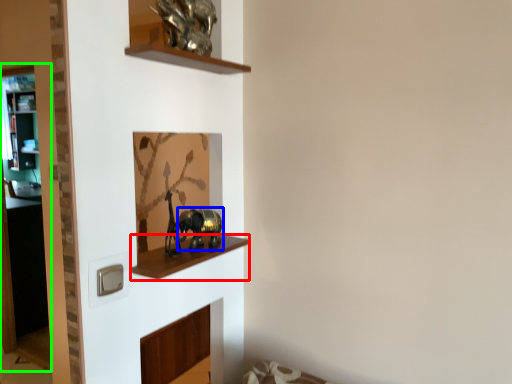
Question: Which is nearer to the cabinet (highlighted by a red box)? animal (highlighted by a blue box) or glass door (highlighted by a green box).

Choices:
 (A) animal
 (B) glass door

Answer: (A)